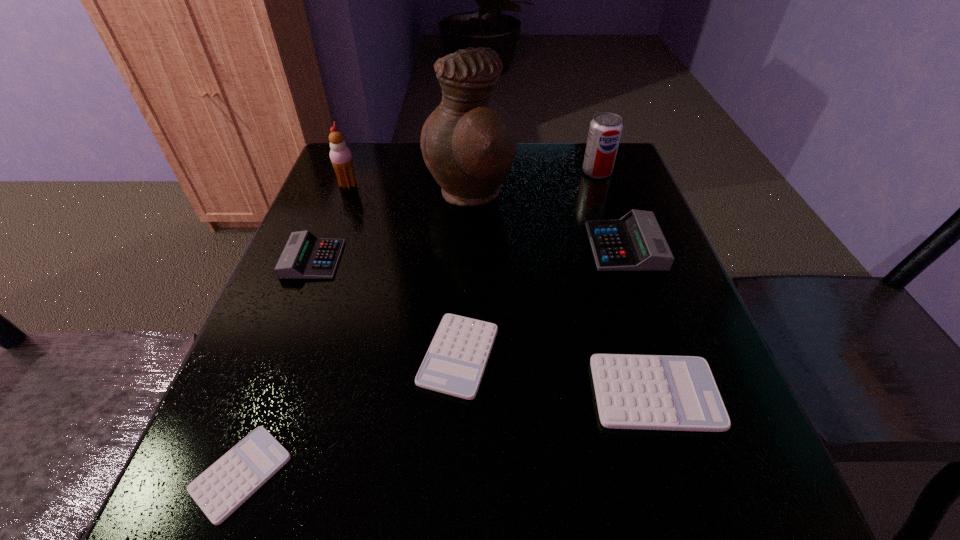
Find the location of `the fourth tallest calculator`. the fourth tallest calculator is located at coordinates (454, 364).

Locate an element on the screen. The height and width of the screenshot is (540, 960). the seventh tallest object is located at coordinates (454, 364).

The height and width of the screenshot is (540, 960). I want to click on the shortest calculator, so click(x=222, y=488).

Image resolution: width=960 pixels, height=540 pixels. In order to click on the leftmost white calculator in this screenshot , I will do `click(222, 488)`.

Where is `vacant space located 0.150m at the spout of the tallest object`? vacant space located 0.150m at the spout of the tallest object is located at coordinates (575, 196).

Locate an element on the screen. This screenshot has height=540, width=960. vacant space situated 0.080m at the front with a straw on the icecream is located at coordinates (389, 185).

Find the location of a particular element. free location located on the front of the soda is located at coordinates 637,288.

The image size is (960, 540). I want to click on free space located on the left of the fourth tallest object, so (550, 246).

What are the coordinates of `vacant position located 0.370m on the back of the left gray calculator` in the screenshot? It's located at (354, 156).

Where is `vacant area situated on the front of the biggest white calculator`? vacant area situated on the front of the biggest white calculator is located at coordinates (697, 529).